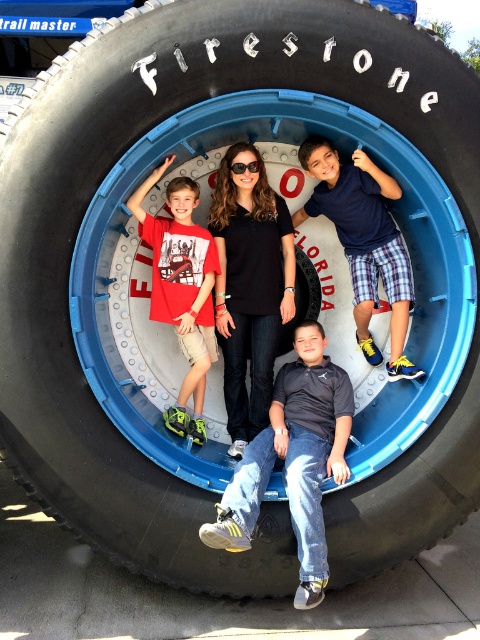
Is black matte shirt at center smaller than matte red t-shirt at left?

Yes, black matte shirt at center is smaller than matte red t-shirt at left.

Does black matte shirt at center have a lesser height compared to matte red t-shirt at left?

No.

Which is behind, point (264, 246) or point (146, 220)?

The point (264, 246) is behind.

What are the coordinates of `black matte shirt at center` in the screenshot? It's located at (250, 285).

The height and width of the screenshot is (640, 480). I want to click on dark gray fabric shirt at center, so coord(294,460).

Between dark gray fabric shirt at center and black matte shirt at center, which one has more height?

→ Standing taller between the two is black matte shirt at center.

Where is `dark gray fabric shirt at center`? dark gray fabric shirt at center is located at coordinates (294, 460).

Where is `dark gray fabric shirt at center`? dark gray fabric shirt at center is located at coordinates (294, 460).

Which of these two, black matte shirt at center or blue plaid shorts at lower right, stands taller?

black matte shirt at center

Is black matte shirt at center thinner than blue plaid shorts at lower right?

Correct, black matte shirt at center's width is less than blue plaid shorts at lower right's.

Image resolution: width=480 pixels, height=640 pixels. Identify the location of black matte shirt at center. (250, 285).

Locate an element on the screen. The height and width of the screenshot is (640, 480). black matte shirt at center is located at coordinates (250, 285).